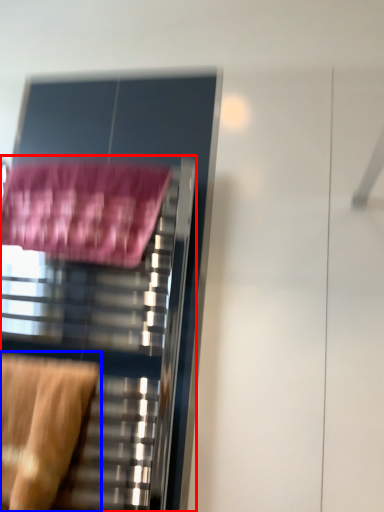
Question: Which object appears closest to the camera in this image, furniture (highlighted by a red box) or swivel chair (highlighted by a blue box)?

Choices:
 (A) furniture
 (B) swivel chair

Answer: (B)